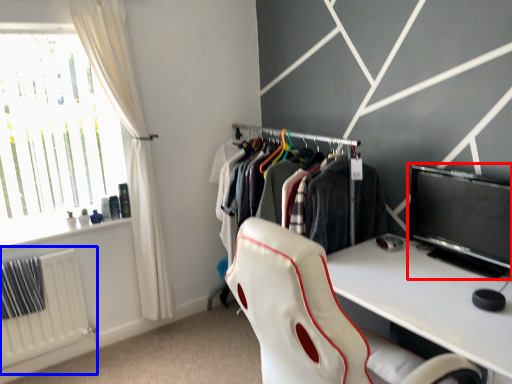
Question: Which of the following is the farthest to the observer, computer monitor (highlighted by a red box) or radiator (highlighted by a blue box)?

Choices:
 (A) computer monitor
 (B) radiator

Answer: (B)